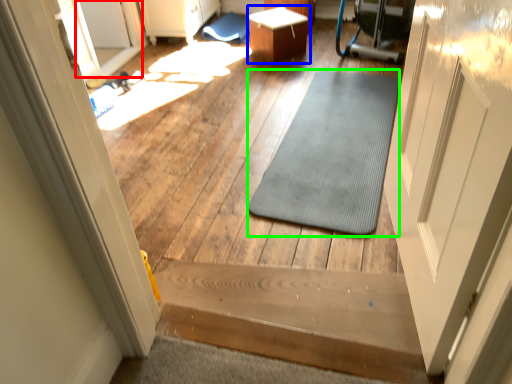
Question: Considering the real-world distances, which object is closest to glass door (highlighted by a red box)? table (highlighted by a blue box) or mat (highlighted by a green box).

Choices:
 (A) table
 (B) mat

Answer: (A)